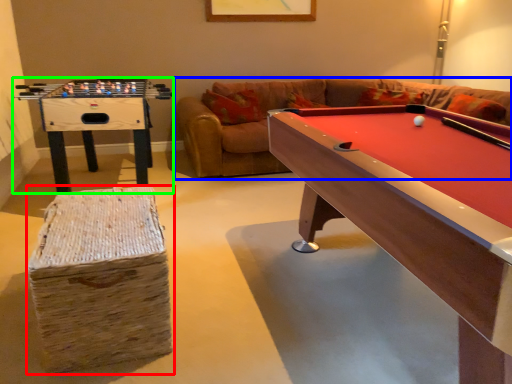
Question: Which object is positioned closest to bar stool (highlighted by a red box)? Select from couch (highlighted by a blue box) and table (highlighted by a green box).

Choices:
 (A) couch
 (B) table

Answer: (B)